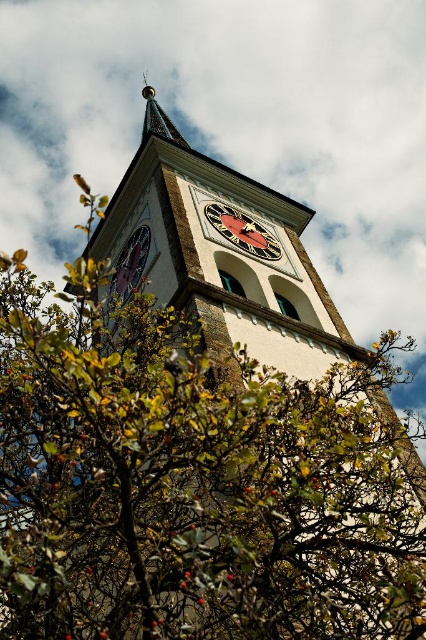
You are standing in front of the clock tower and want to take a photo that includes both the green leafy bush at lower center and the gold metallic spire at upper center. Which object will appear larger in the photo?

The gold metallic spire at upper center will appear larger in the photo because it is taller than the green leafy bush at lower center.

You are standing 20 meters away from the green leafy bush at lower center. Can you see the clock face details clearly?

The green leafy bush at lower center is 19.79 meters from viewer, so you are standing at 20 meters away, which is slightly further than the actual distance. Therefore, you might not be able to see the clock face details clearly.